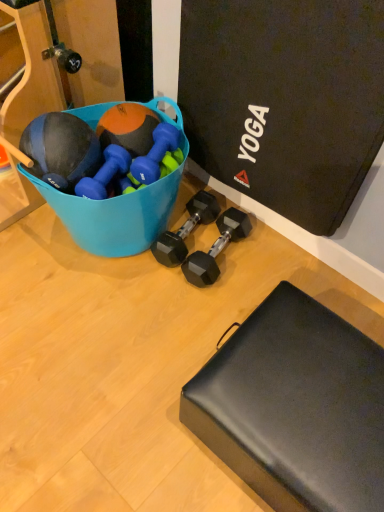
The image size is (384, 512). I want to click on vacant space behind black rubber dumbbell at center, marked as the first dumbbell in a right-to-left arrangement, so click(x=240, y=210).